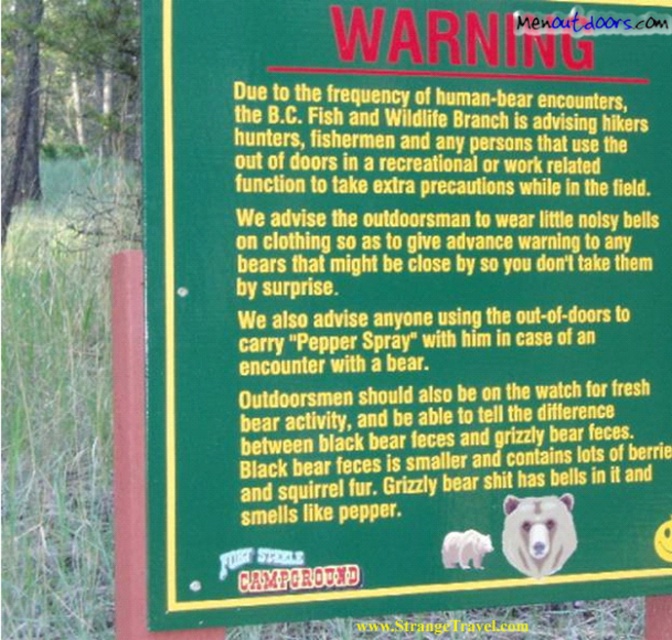
Can you confirm if brown furry bear at center is smaller than white fur bear at lower center?

Incorrect, brown furry bear at center is not smaller in size than white fur bear at lower center.

Between brown furry bear at center and white fur bear at lower center, which one has less height?

white fur bear at lower center is shorter.

At what (x,y) coordinates should I click in order to perform the action: click on brown furry bear at center. Please return your answer as a coordinate pair (x, y). This screenshot has height=640, width=672. Looking at the image, I should click on (538, 532).